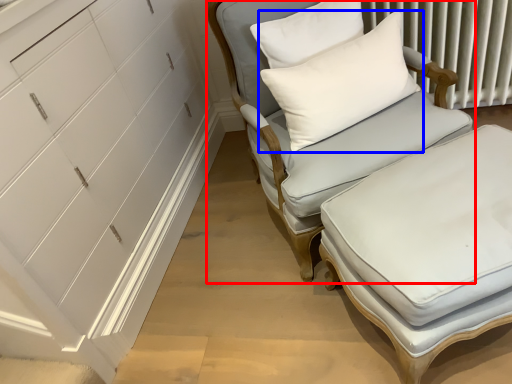
Question: Among these objects, which one is farthest to the camera, chair (highlighted by a red box) or pillow (highlighted by a blue box)?

Choices:
 (A) chair
 (B) pillow

Answer: (B)